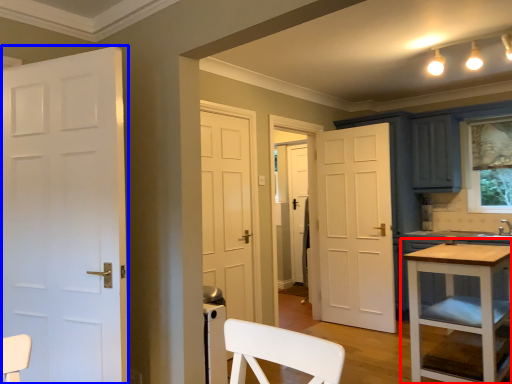
Question: Which object is closer to the camera taking this photo, table (highlighted by a red box) or door (highlighted by a blue box)?

Choices:
 (A) table
 (B) door

Answer: (B)